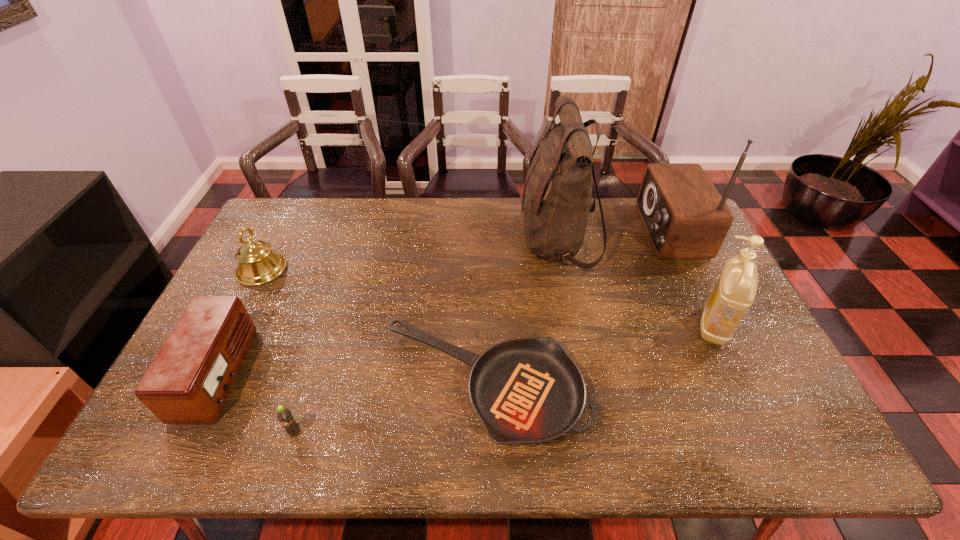
Identify the location of backpack situated at the far edge. This screenshot has height=540, width=960. (557, 194).

Image resolution: width=960 pixels, height=540 pixels. What are the coordinates of `radio receiver that is at the far edge` in the screenshot? It's located at 685,217.

This screenshot has height=540, width=960. I want to click on radio receiver located at the near edge, so click(x=188, y=381).

The width and height of the screenshot is (960, 540). Identify the location of soda that is positioned at the near edge. (284, 415).

Identify the location of frying pan at the near edge. (525, 390).

Image resolution: width=960 pixels, height=540 pixels. I want to click on bell that is positioned at the left edge, so click(257, 264).

The image size is (960, 540). Identify the location of radio receiver that is at the left edge. (188, 381).

At what (x,y) coordinates should I click in order to perform the action: click on radio receiver that is at the right edge. Please return your answer as a coordinate pair (x, y). The width and height of the screenshot is (960, 540). Looking at the image, I should click on pyautogui.click(x=685, y=217).

Where is `detergent present at the right edge`? The width and height of the screenshot is (960, 540). detergent present at the right edge is located at coordinates (734, 293).

Where is `object positioned at the near left corner`? Image resolution: width=960 pixels, height=540 pixels. object positioned at the near left corner is located at coordinates (x=188, y=381).